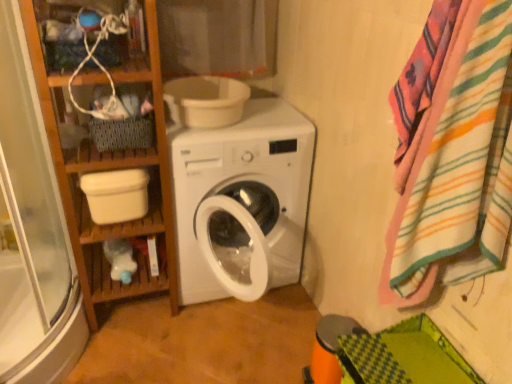
Question: Is woven fabric basket at upper left situated inside white plastic bucket at lower left, arranged as the first toilet bowl when ordered from the bottom, or outside?

Choices:
 (A) outside
 (B) inside

Answer: (A)

Question: Is woven fabric basket at upper left in front of or behind white plastic bucket at lower left, arranged as the first toilet bowl when ordered from the bottom, in the image?

Choices:
 (A) behind
 (B) front

Answer: (B)

Question: Which object is positioned farthest from the wooden bookshelf at left?

Choices:
 (A) white plastic bucket at lower left, the second toilet bowl positioned from the right
 (B) cotton curtain at upper center
 (C) wooden shelf at upper left
 (D) white plastic bowl at upper center, which appears as the second toilet bowl when ordered from the bottom
 (E) striped cotton bath towel at right

Answer: (E)

Question: Which of these objects is positioned closest to the cotton curtain at upper center?

Choices:
 (A) wooden bookshelf at left
 (B) striped cotton bath towel at right
 (C) white plastic bucket at lower left, the second toilet bowl positioned from the right
 (D) woven fabric basket at upper left
 (E) white plastic bowl at upper center, the 2th toilet bowl when ordered from left to right

Answer: (E)